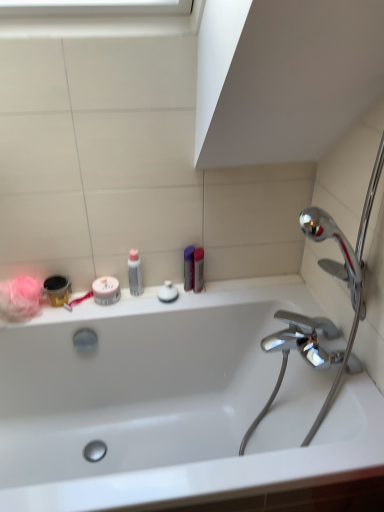
Question: Based on their positions, is metallic silver toothbrush at left located to the left or right of white matte jar at center, which ranks as the 2th mouthwash in right-to-left order?

Choices:
 (A) right
 (B) left

Answer: (B)

Question: In terms of size, does metallic silver toothbrush at left appear bigger or smaller than white matte jar at center, marked as the first mouthwash in a left-to-right arrangement?

Choices:
 (A) small
 (B) big

Answer: (A)

Question: Considering the real-world distances, which object is farthest from the white glossy soap at center, the second toiletry positioned from the right?

Choices:
 (A) white matte jar at center, which ranks as the 2th mouthwash in right-to-left order
 (B) white glossy bathtub at center
 (C) purple plastic container at upper center, which appears as the third toiletry when viewed from the left
 (D) translucent plastic bottle at upper center, which appears as the 3th toiletry when viewed from the right
 (E) metallic silver toothbrush at left

Answer: (B)

Question: Which object is positioned closest to the white glossy soap at center, placed as the 2th toiletry when sorted from left to right?

Choices:
 (A) translucent plastic bottle at upper center, which appears as the 3th toiletry when viewed from the right
 (B) white glossy bathtub at center
 (C) metallic silver toothbrush at left
 (D) purple plastic container at upper center, which appears as the third toiletry when viewed from the left
 (E) metallic silver mouthwash at right, acting as the 2th mouthwash starting from the left

Answer: (D)